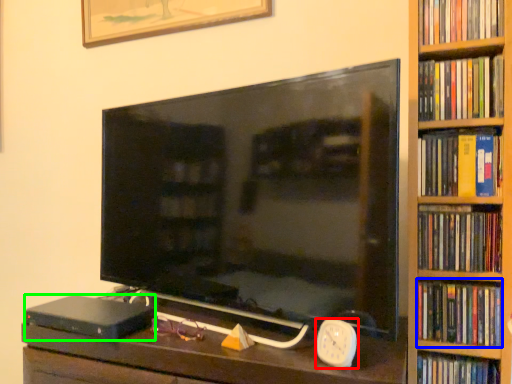
Question: Considering the real-world distances, which object is closest to clock (highlighted by a red box)? book (highlighted by a blue box) or paperback book (highlighted by a green box).

Choices:
 (A) book
 (B) paperback book

Answer: (A)